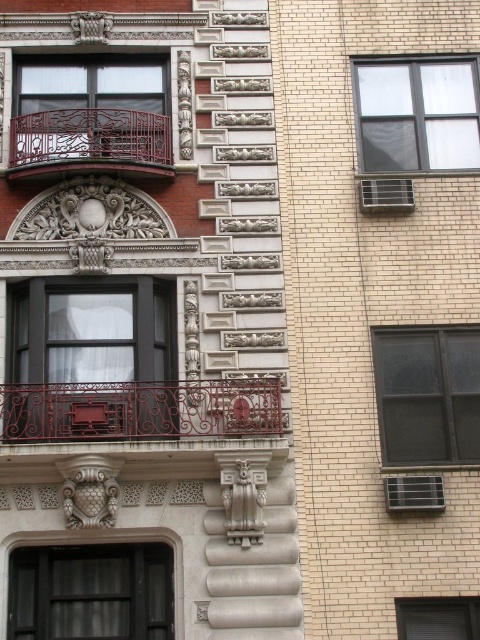
Does matte black balcony at left have a lesser width compared to clear glass window at lower right?

Incorrect, matte black balcony at left's width is not less than clear glass window at lower right's.

Which is behind, point (166, 129) or point (423, 598)?

Point (166, 129)

Identify the location of matte black balcony at left. (91, 113).

This screenshot has height=640, width=480. Identify the location of matte black balcony at left. (91, 113).

Does rustic wrought iron balcony at upper left have a lesser width compared to clear glass window at lower right?

Correct, rustic wrought iron balcony at upper left's width is less than clear glass window at lower right's.

Is point (123, 124) positioned in front of point (421, 621)?

No, (123, 124) is behind (421, 621).

Find the location of a particular element. The image size is (480, 640). rustic wrought iron balcony at upper left is located at coordinates (90, 144).

Which is behind, point (38, 97) or point (49, 168)?

Point (38, 97)

Can you confirm if matte black balcony at left is smaller than rustic wrought iron balcony at upper left?

Incorrect, matte black balcony at left is not smaller in size than rustic wrought iron balcony at upper left.

Who is more forward, [16,163] or [108,147]?

Positioned in front is point [108,147].

This screenshot has width=480, height=640. Find the location of `matte black balcony at left`. matte black balcony at left is located at coordinates (91, 113).